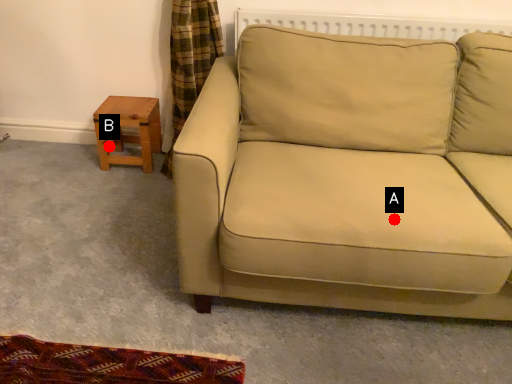
Question: Two points are circled on the image, labeled by A and B beside each circle. Which point is farther from the camera taking this photo?

Choices:
 (A) A is further
 (B) B is further

Answer: (B)